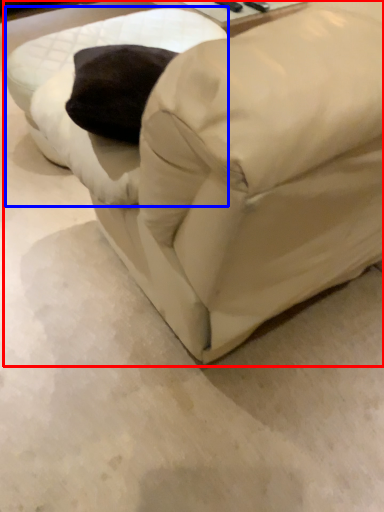
Question: Which point is further to the camera, furniture (highlighted by a red box) or swivel chair (highlighted by a blue box)?

Choices:
 (A) furniture
 (B) swivel chair

Answer: (B)